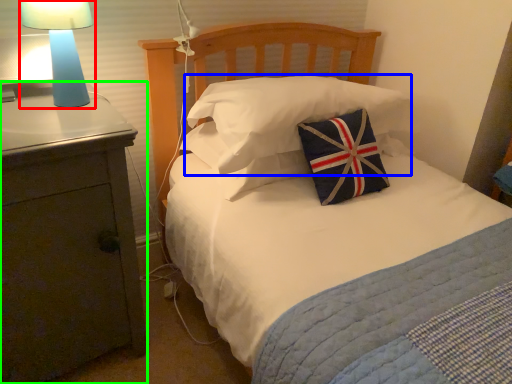
Question: Considering the real-world distances, which object is farthest from lamp (highlighted by a red box)? pillow (highlighted by a blue box) or nightstand (highlighted by a green box)?

Choices:
 (A) pillow
 (B) nightstand

Answer: (A)